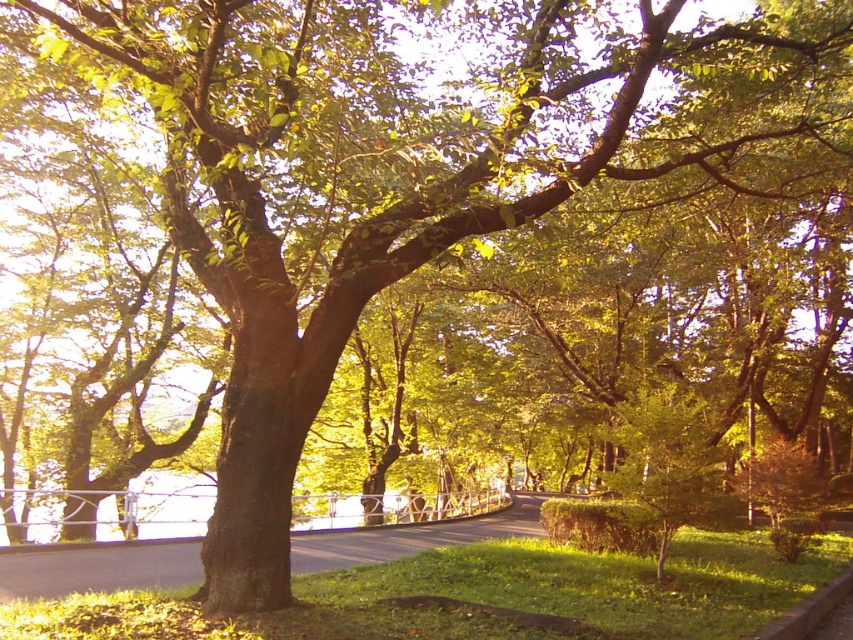
Which is in front, point (50, 563) or point (817, 589)?

Point (817, 589) is in front.

Based on the photo, does green grass at center have a smaller size compared to concrete curb at lower right?

Actually, green grass at center might be larger than concrete curb at lower right.

Does point (303, 561) lie behind point (785, 636)?

Yes.

Find the location of a particular element. green grass at center is located at coordinates (97, 566).